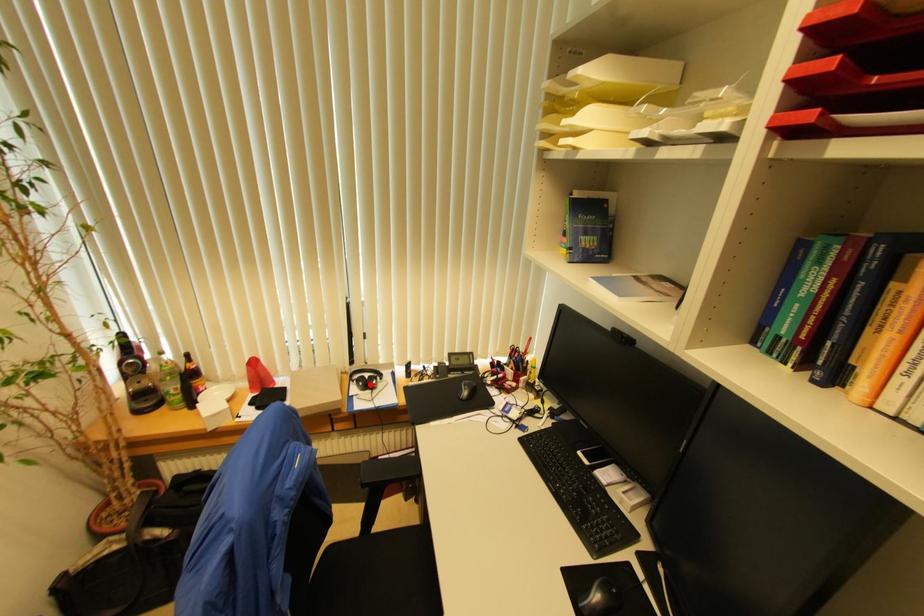
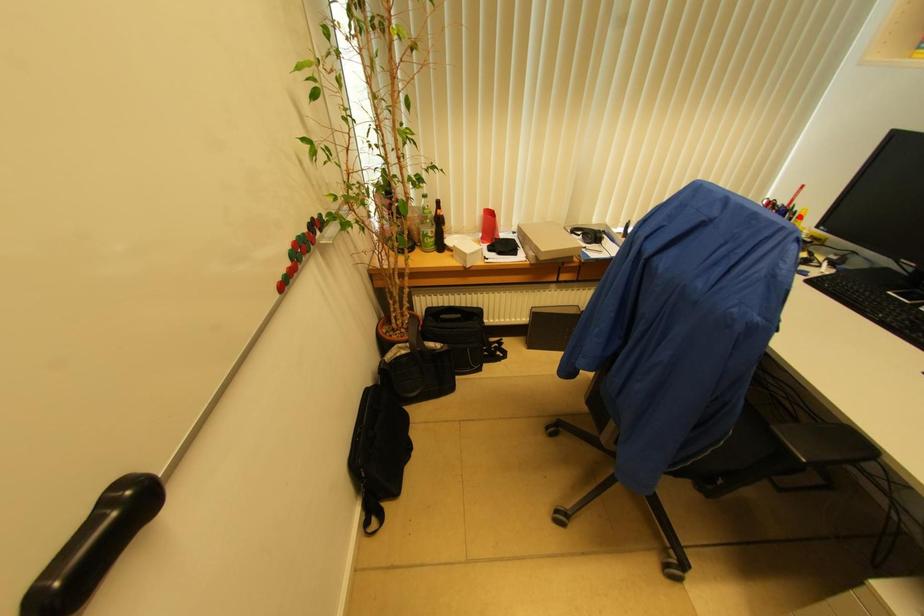
I am providing you with two images of the same scene from different viewpoints. A red point is marked on the first image and another point is marked on the second image. Is the marked point in image1 the same physical position as the marked point in image2?

No